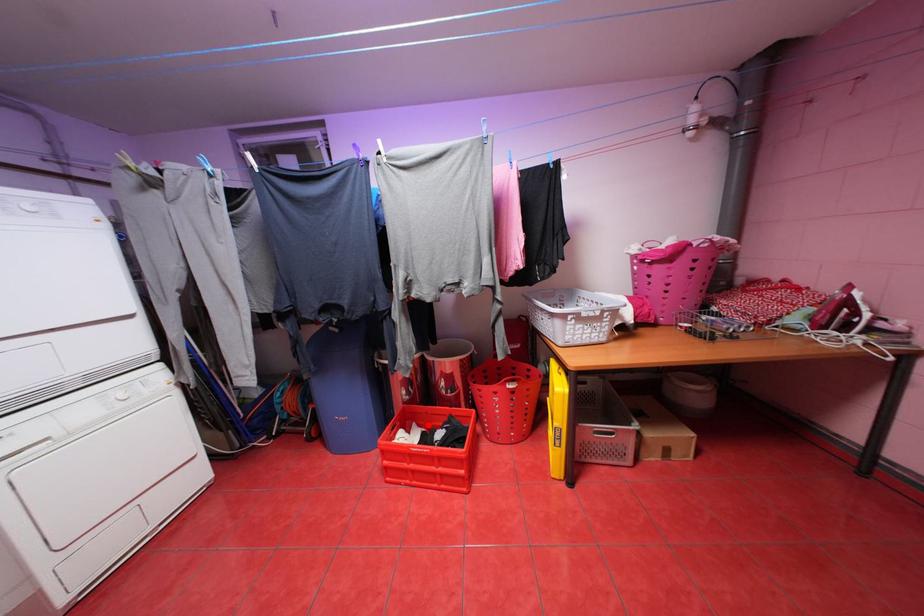
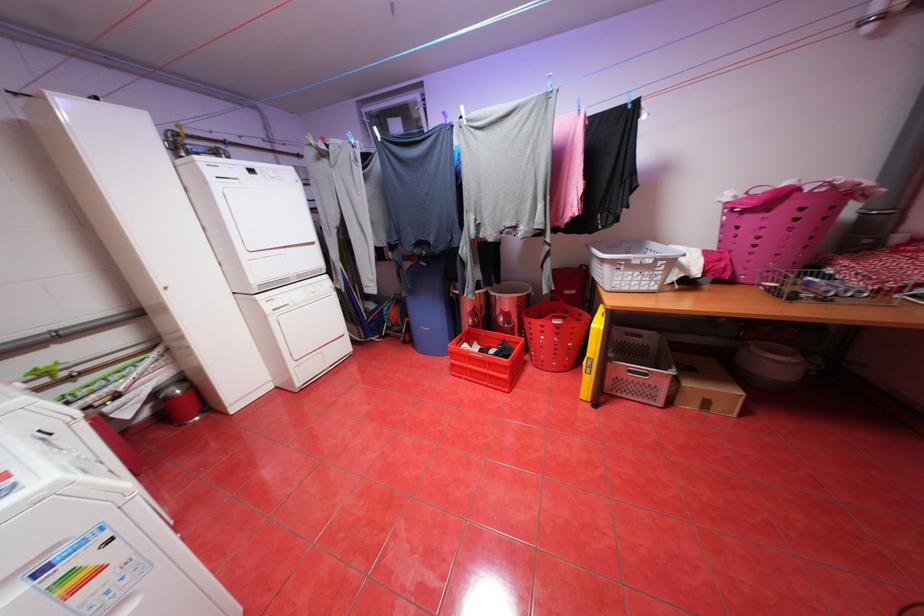
Find the pixel in the second image that matches the highlighted location in the first image.

(488, 344)